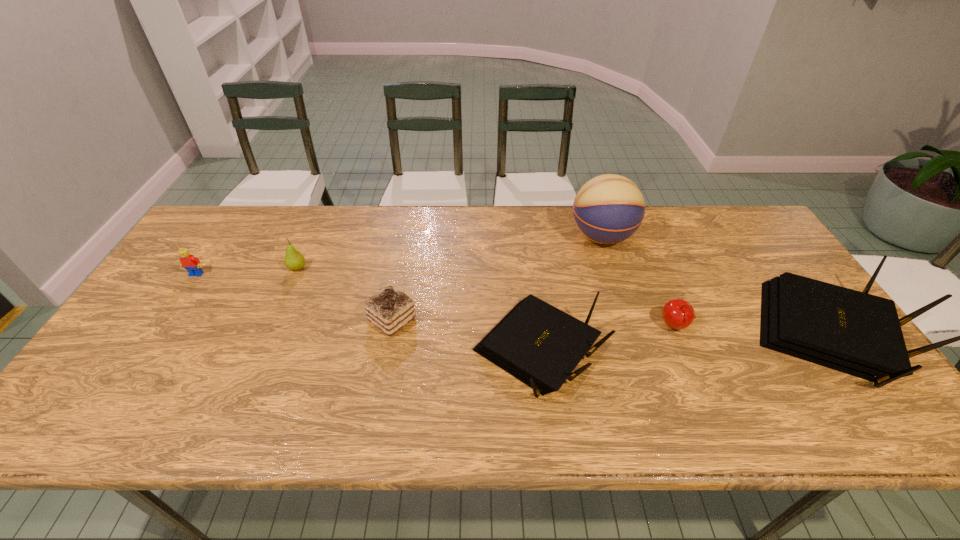
The height and width of the screenshot is (540, 960). In order to click on object that is the second nearest to the left router in this screenshot , I will do `click(678, 314)`.

Identify the location of vacant region that satisfies the following two spatial constraints: 1. on the patterned surface of the basketball; 2. on the face of the Lego. [613, 274].

Identify the location of vacant space that satisfies the following two spatial constraints: 1. on the face of the Lego; 2. on the left side of the fifth shortest object. (145, 351).

The width and height of the screenshot is (960, 540). In order to click on free region that satisfies the following two spatial constraints: 1. on the front side of the fifth object from right to left; 2. on the left side of the left router in this screenshot , I will do `click(386, 351)`.

In order to click on free location that satisfies the following two spatial constraints: 1. on the face of the fifth shortest object; 2. on the left side of the leftmost object in this screenshot , I will do (x=145, y=351).

Locate an element on the screen. The image size is (960, 540). blank area in the image that satisfies the following two spatial constraints: 1. on the patterned surface of the cherry; 2. on the left side of the farthest object is located at coordinates (630, 327).